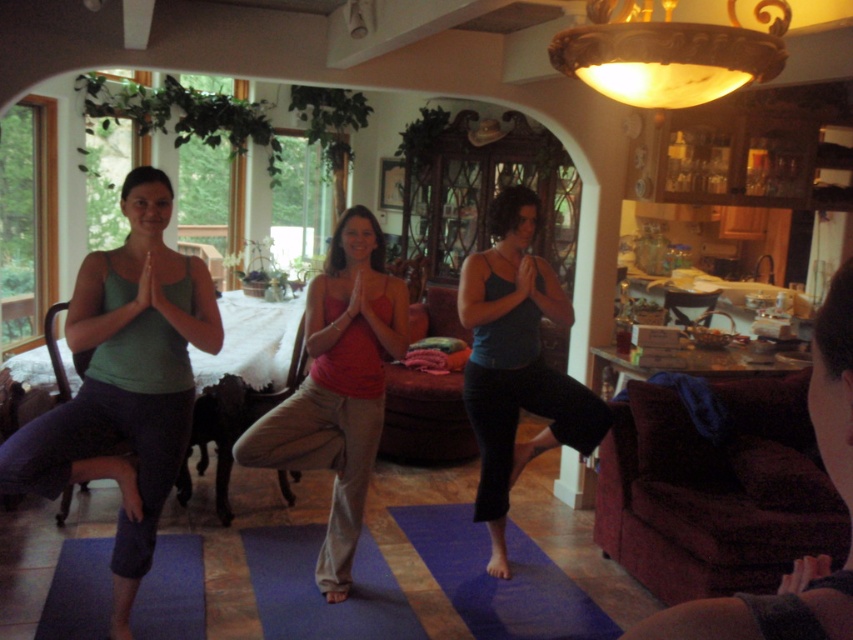
Question: Is green matte tank top at center in front of blue rubber mat at center?

Choices:
 (A) yes
 (B) no

Answer: (A)

Question: Which point is closer to the camera?

Choices:
 (A) blue rubber mat at center
 (B) green matte tank top at center
 (C) matte blue tank top at center
 (D) matte red tank top at center

Answer: (B)

Question: Observing the image, what is the correct spatial positioning of green matte tank top at center in reference to blue rubber mat at center?

Choices:
 (A) below
 (B) above

Answer: (B)

Question: Among these points, which one is farthest from the camera?

Choices:
 (A) (496, 582)
 (B) (90, 285)

Answer: (A)

Question: Which of the following is the closest to the observer?

Choices:
 (A) (90, 445)
 (B) (494, 388)

Answer: (A)

Question: Is green matte tank top at center thinner than blue rubber mat at center?

Choices:
 (A) yes
 (B) no

Answer: (A)